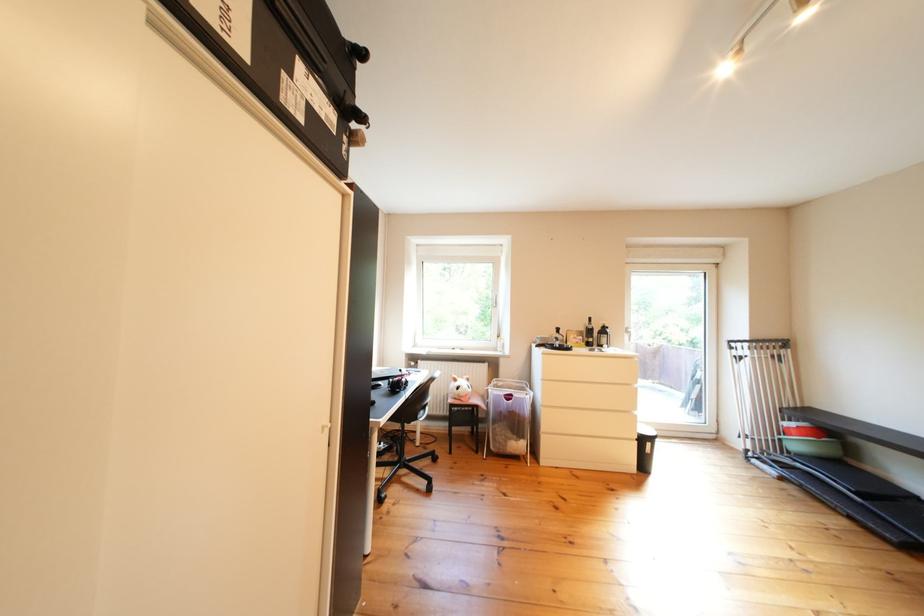
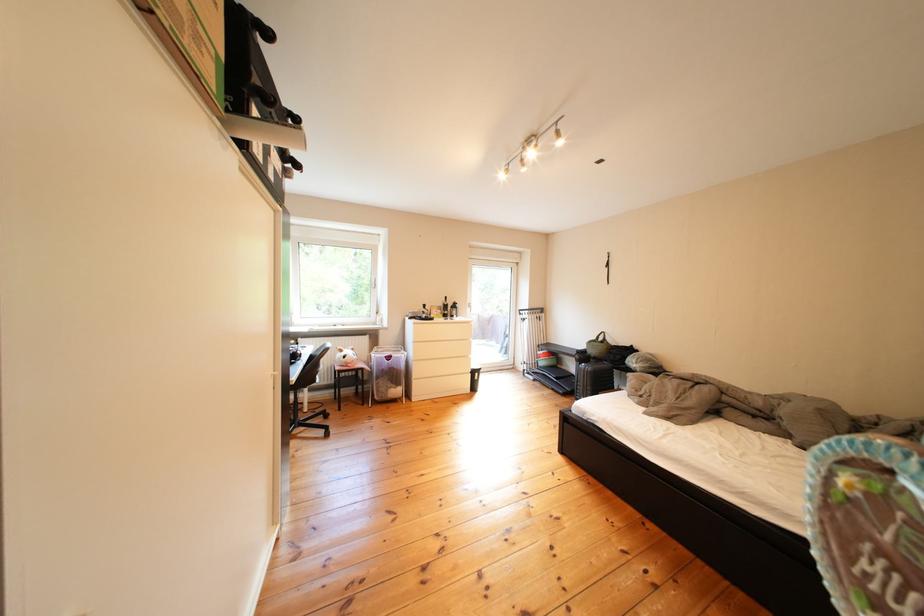
Find the pixel in the second image that matches point 507,426 in the first image.

(392, 382)